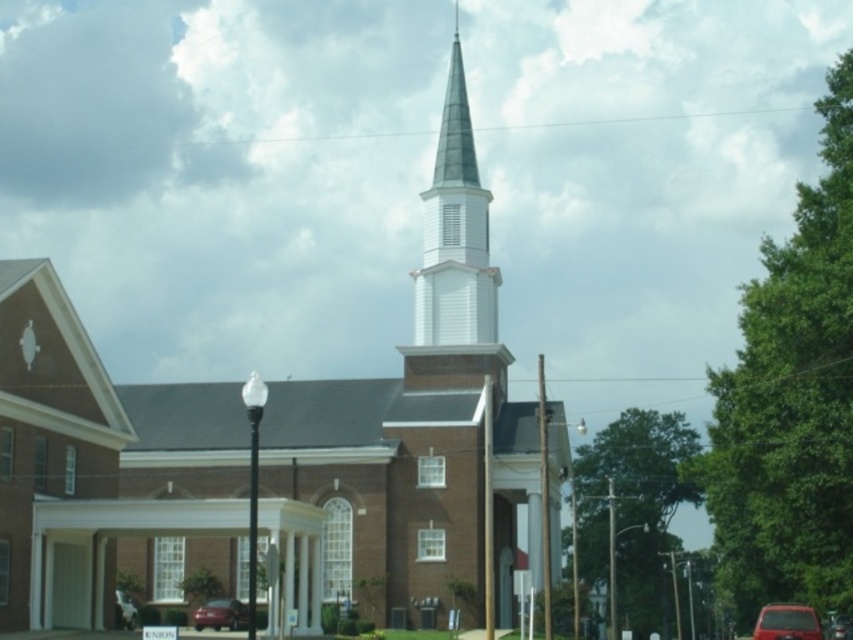
Is matte red car at lower left taller than metallic silver sedan at center?

Yes, matte red car at lower left is taller than metallic silver sedan at center.

Measure the distance between point (233, 621) and camera.

96.15 meters

Locate an element on the screen. The width and height of the screenshot is (853, 640). matte red car at lower left is located at coordinates (219, 614).

Is matte red car at lower right positioned at the back of matte red car at lower left?

That is True.

Does matte red car at lower right have a greater width compared to matte red car at lower left?

No.

Is point (759, 621) positioned after point (230, 612)?

No, it is in front of (230, 612).

Locate an element on the screen. matte red car at lower right is located at coordinates (787, 621).

Between point (259, 454) and point (779, 630), which one is positioned in front?

Positioned in front is point (779, 630).

Between brown brick church steeple at center and matte red car at lower right, which one is positioned lower?

matte red car at lower right is below.

Who is more forward, (456, 458) or (811, 621)?

Point (811, 621)

I want to click on brown brick church steeple at center, so click(286, 452).